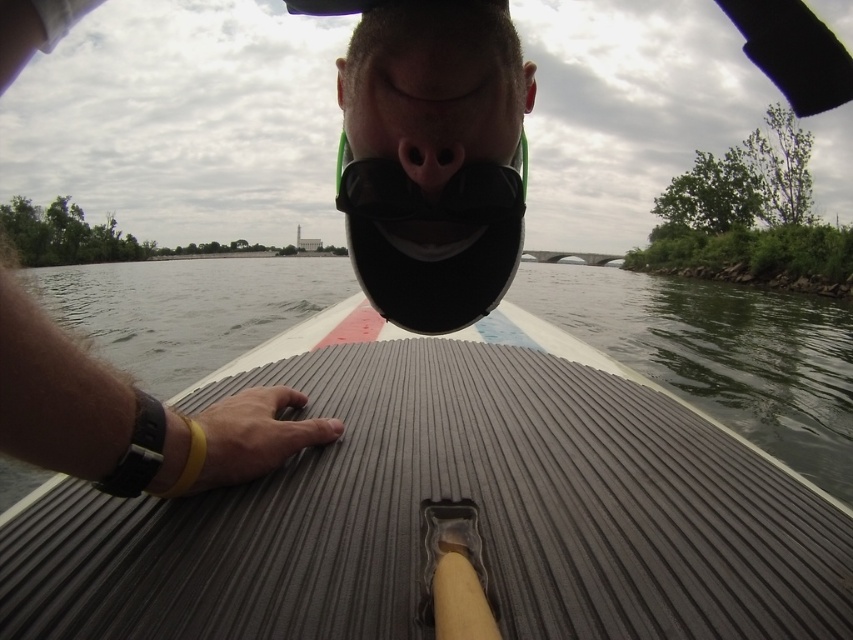
You are trying to balance on a gray ribbed paddleboard at center while holding a matte black mouth at center. Which object would require more space to move around?

The gray ribbed paddleboard at center requires more space to move around since it has a larger size compared to the matte black mouth at center.

Based on the photo, you are in a first person perspective scene where you see a black cap with a green chin strap and a playful mustache and mouth design. There is a paddle at the bottom center. A point at coordinates (430,86) is present. Which object does this point lie on?

The point at (430,86) lies on the matte black mouth at center.

You are navigating a boat deck and need to place two markers at the coordinates point (222, 508) and point (434, 182). Which marker should you place first if you want to start with the one closer to you?

You should place the marker at point (222, 508) first because it is closer to the viewer than point (434, 182).